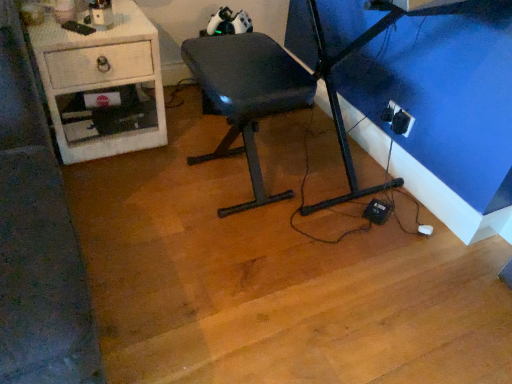
This screenshot has height=384, width=512. What are the coordinates of `vacant space in matte black chair at center (from a real-world perspective)` in the screenshot? It's located at pyautogui.click(x=224, y=183).